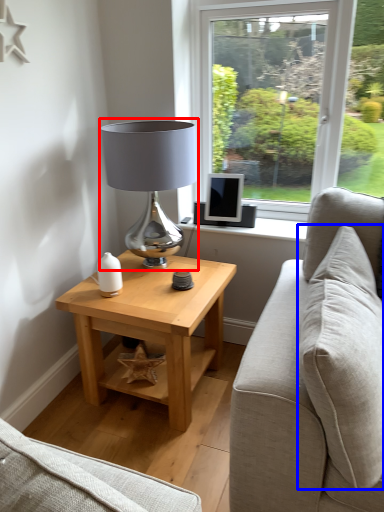
Question: Among these objects, which one is nearest to the camera, table lamp (highlighted by a red box) or pillow (highlighted by a blue box)?

Choices:
 (A) table lamp
 (B) pillow

Answer: (B)